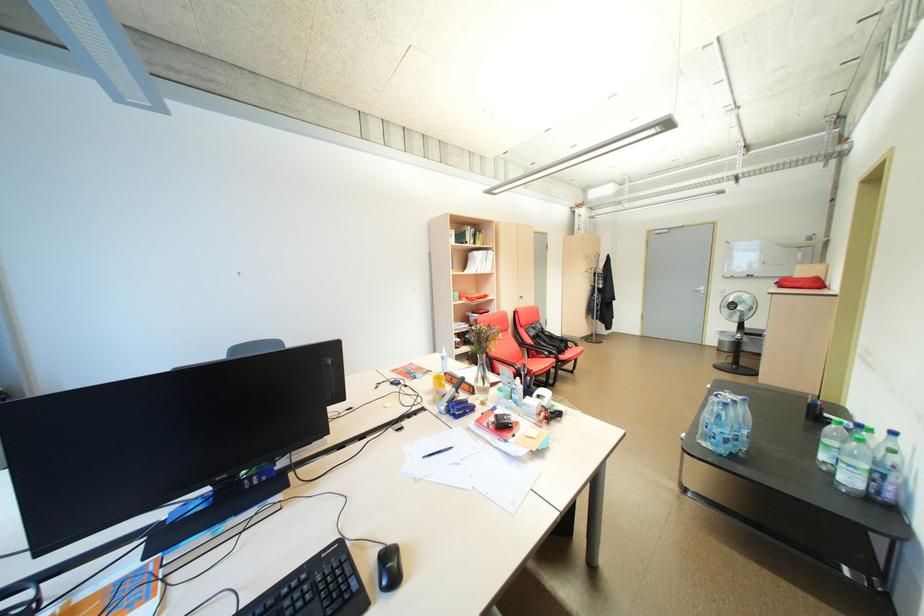
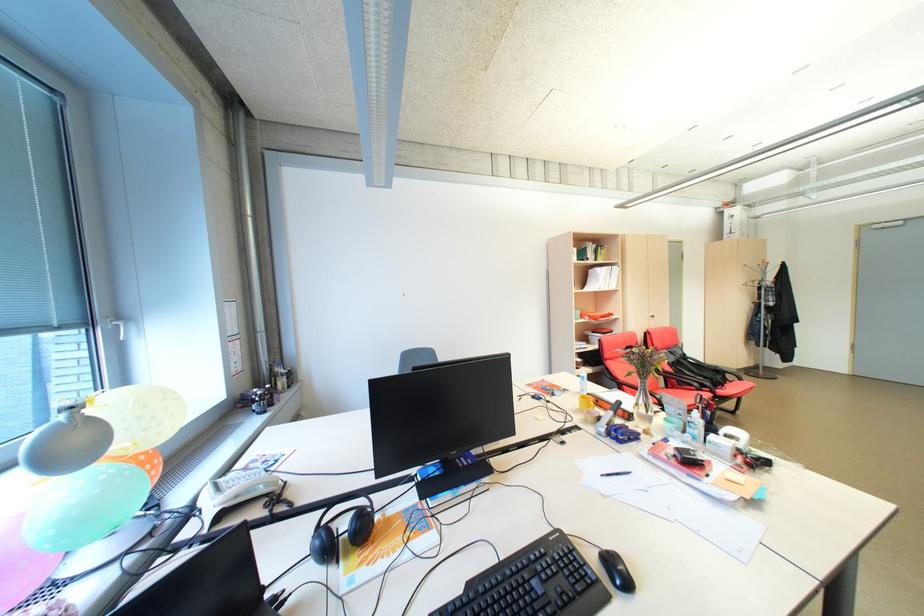
Find the pixel in the second image that matches point (446, 398) in the first image.

(600, 418)